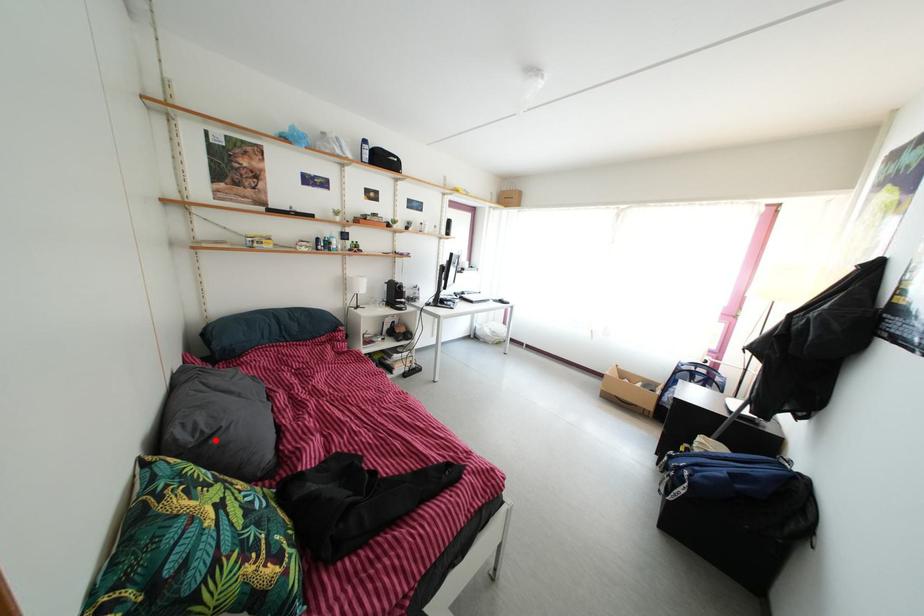
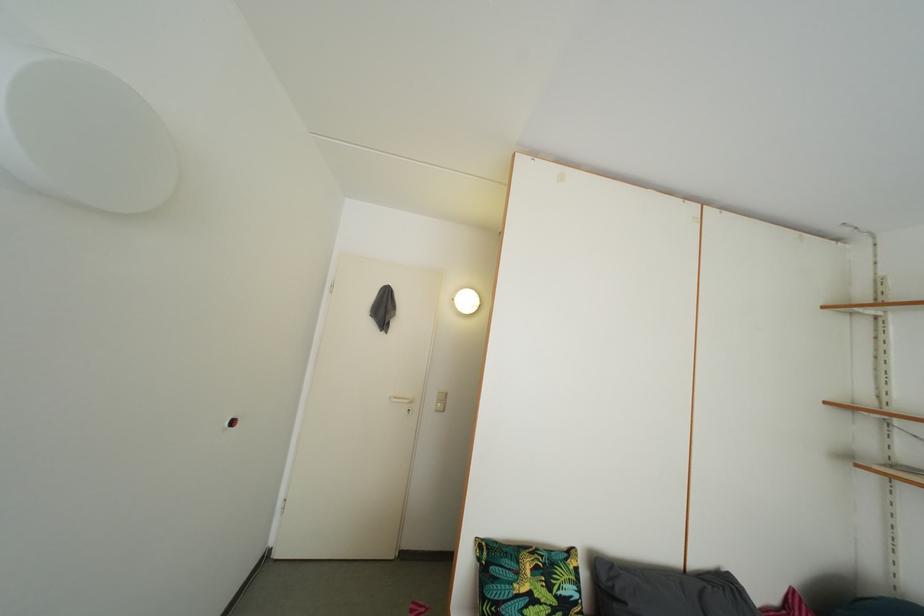
Locate, in the second image, the point that corresponds to the highlighted location in the first image.

(624, 601)